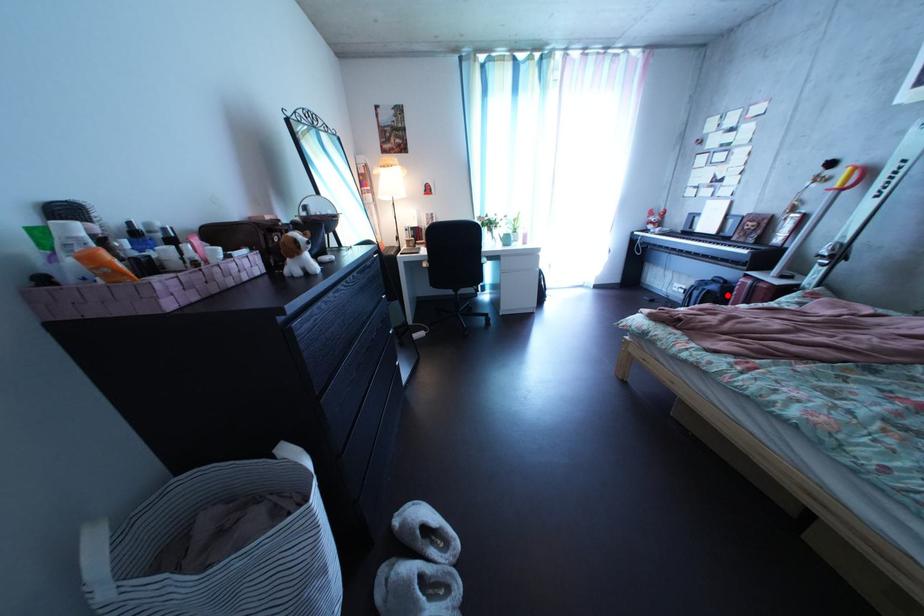
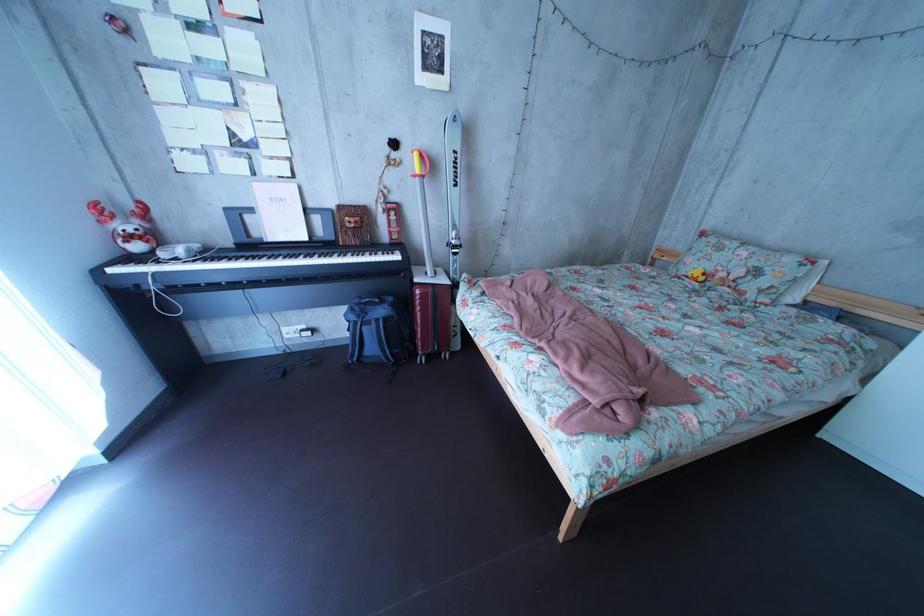
Question: I am providing you with two images of the same scene from different viewpoints. Image1 has a red point marked. In image2, the corresponding 3D location appears at what relative position? Reply with the corresponding letter.

Choices:
 (A) Closer
 (B) Farther

Answer: (B)